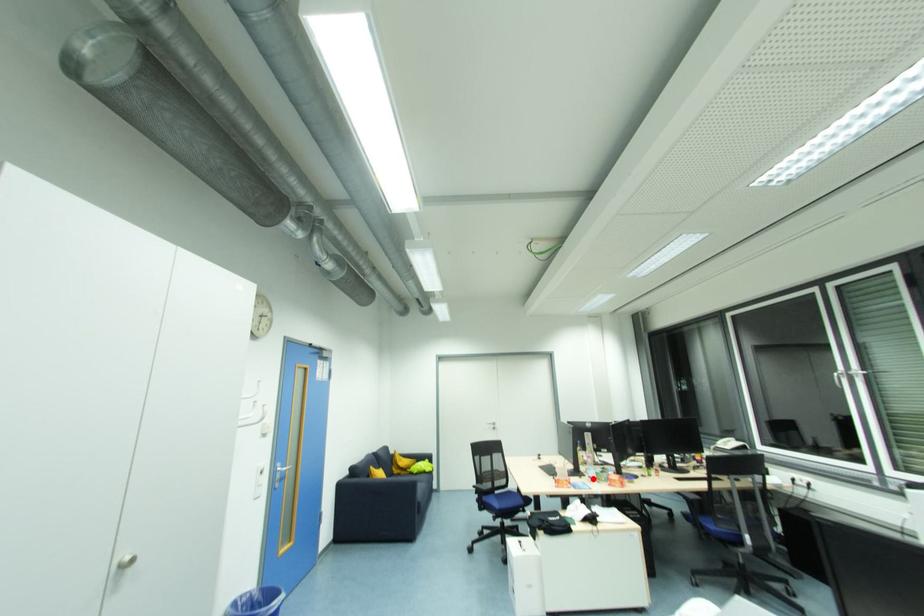
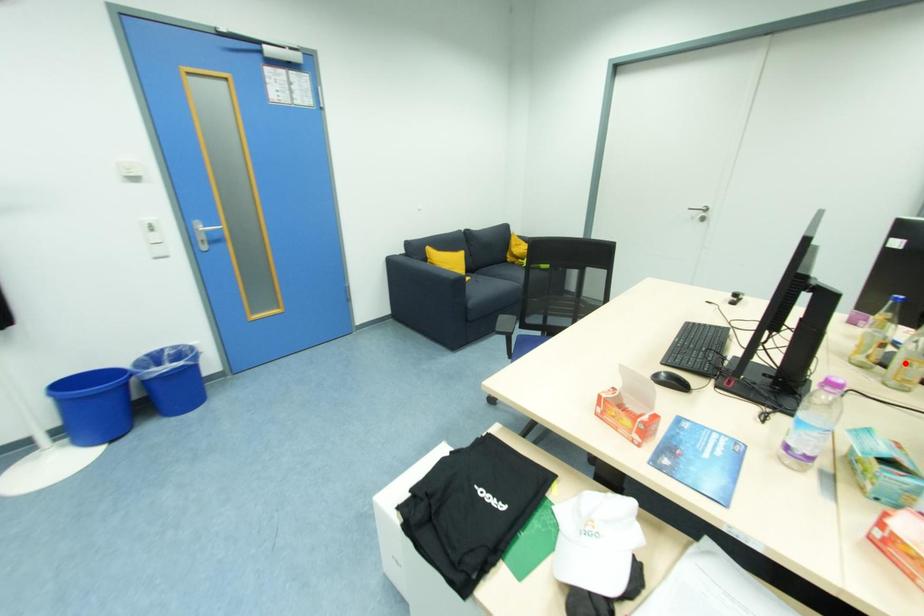
I am providing you with two images of the same scene from different viewpoints. A red point is marked on the first image and another point is marked on the second image. Do the highlighted points in image1 and image2 indicate the same real-world spot?

No